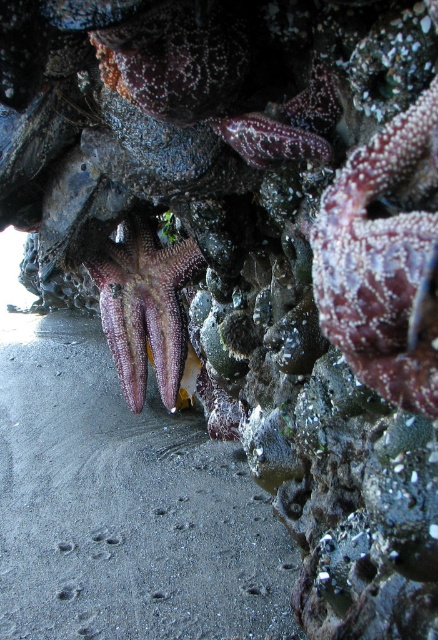
Looking at this image, you are standing at the center of the rocky coastal environment and want to move to the smooth sand at lower left. What direction should you walk to reach it?

You should walk towards the lower left direction to reach the smooth sand at lower left.

You are a marine biologist observing the rocky coastal environment. You notice the smooth sand at lower left and the rough textured starfish at center. Which object is positioned lower in the scene?

The smooth sand at lower left is located below the rough textured starfish at center, so it is positioned lower in the scene.

You are a marine biologist examining the tide pool. You notice the smooth sand at lower left and the rough textured starfish at center. Which object is located to the left of the other?

The smooth sand at lower left is positioned on the left side of rough textured starfish at center.